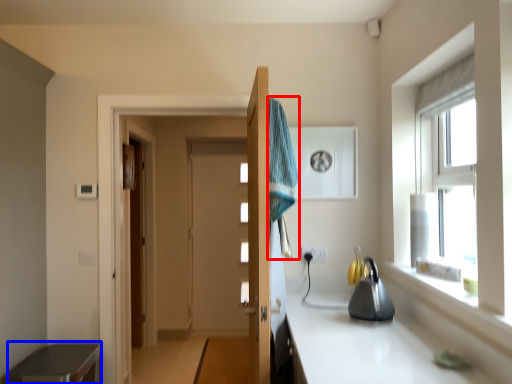
Question: Which point is further to the camera, bath towel (highlighted by a red box) or cabinetry (highlighted by a blue box)?

Choices:
 (A) bath towel
 (B) cabinetry

Answer: (B)